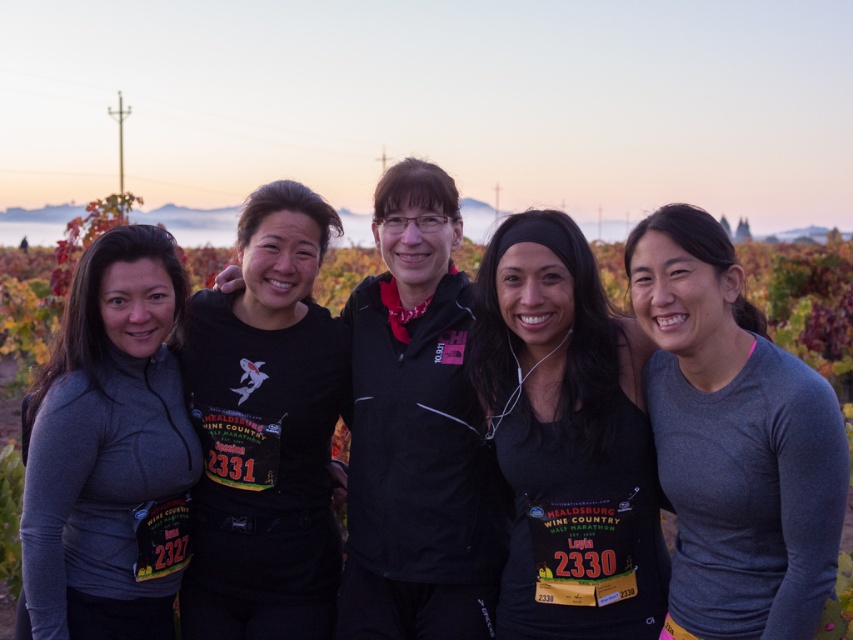
You are a photographer trying to capture a clear shot of both the black matte tank top at center and the black matte shirt at center. Since they are positioned close to each other, will you be able to focus on both subjects simultaneously without one blocking the other?

The black matte tank top at center is in front of the black matte shirt at center, so focusing on both simultaneously may be challenging as the tank top could obscure the shirt partially or fully depending on the camera angle and depth of field.

In the scene shown: You are a photographer setting up for a group photo of runners. You need to ensure that the black matte shirt at center and the matte gray hoodie at left are both visible in the frame. Considering their heights, which runner should you position closer to the front to avoid blocking the other?

The matte gray hoodie at left should be positioned closer to the front since the black matte shirt at center has a greater height, preventing it from being blocked by the taller runner.